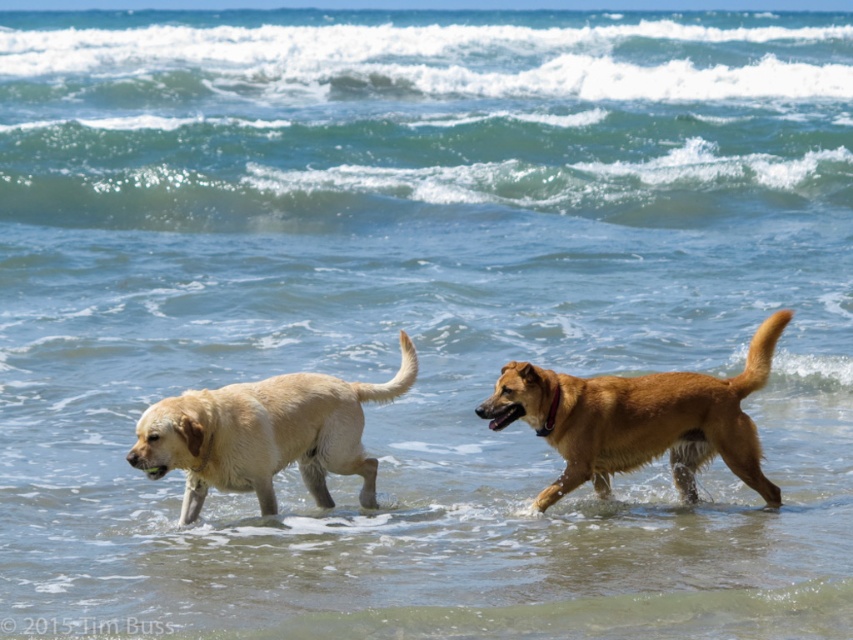
Question: Observing the image, what is the correct spatial positioning of brown furry dog at center in reference to light brown fur dog at left?

Choices:
 (A) above
 (B) below

Answer: (A)

Question: Which object appears farthest from the camera in this image?

Choices:
 (A) brown furry dog at center
 (B) light brown fur dog at left

Answer: (A)

Question: Among these points, which one is nearest to the camera?

Choices:
 (A) (241, 445)
 (B) (689, 422)

Answer: (A)

Question: Among these points, which one is nearest to the camera?

Choices:
 (A) (265, 493)
 (B) (618, 451)

Answer: (B)

Question: From the image, what is the correct spatial relationship of brown furry dog at center in relation to light brown fur dog at left?

Choices:
 (A) above
 (B) below

Answer: (A)

Question: Is brown furry dog at center positioned before light brown fur dog at left?

Choices:
 (A) no
 (B) yes

Answer: (A)